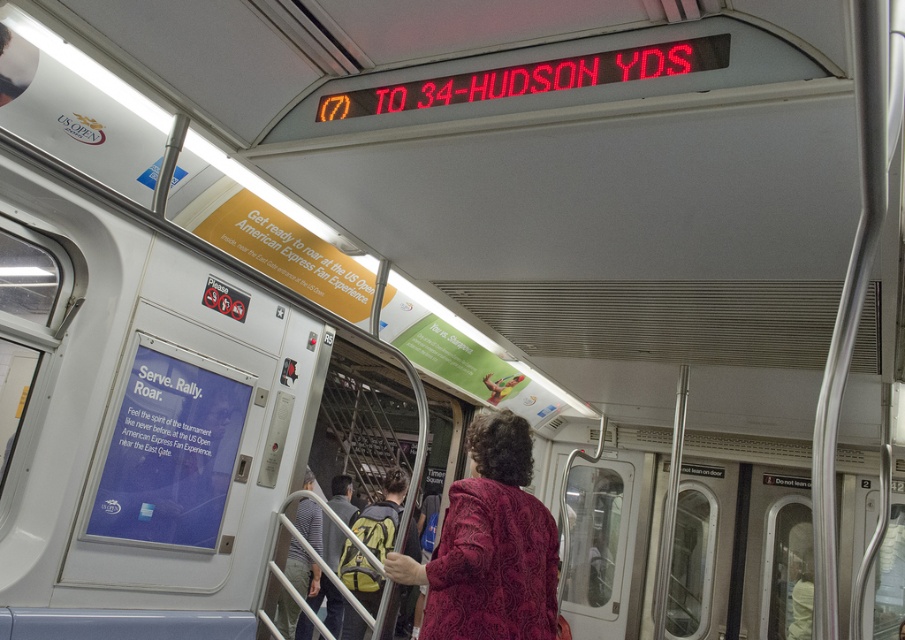
Can you confirm if velvet burgundy coat at center is smaller than green backpack at center?

Yes.

From the picture: Who is higher up, velvet burgundy coat at center or green backpack at center?

velvet burgundy coat at center

This screenshot has width=905, height=640. Identify the location of velvet burgundy coat at center. (491, 545).

Identify the location of velvet burgundy coat at center. This screenshot has width=905, height=640. (491, 545).

Between green backpack at center and striped fabric coach at center, which one has less height?

striped fabric coach at center

Where is `green backpack at center`? green backpack at center is located at coordinates (386, 500).

At what (x,y) coordinates should I click in order to perform the action: click on green backpack at center. Please return your answer as a coordinate pair (x, y). This screenshot has height=640, width=905. Looking at the image, I should click on (386, 500).

Who is taller, velvet burgundy coat at center or striped fabric coach at center?

striped fabric coach at center is taller.

Between point (470, 452) and point (311, 573), which one is positioned behind?

Positioned behind is point (311, 573).

Image resolution: width=905 pixels, height=640 pixels. I want to click on velvet burgundy coat at center, so click(x=491, y=545).